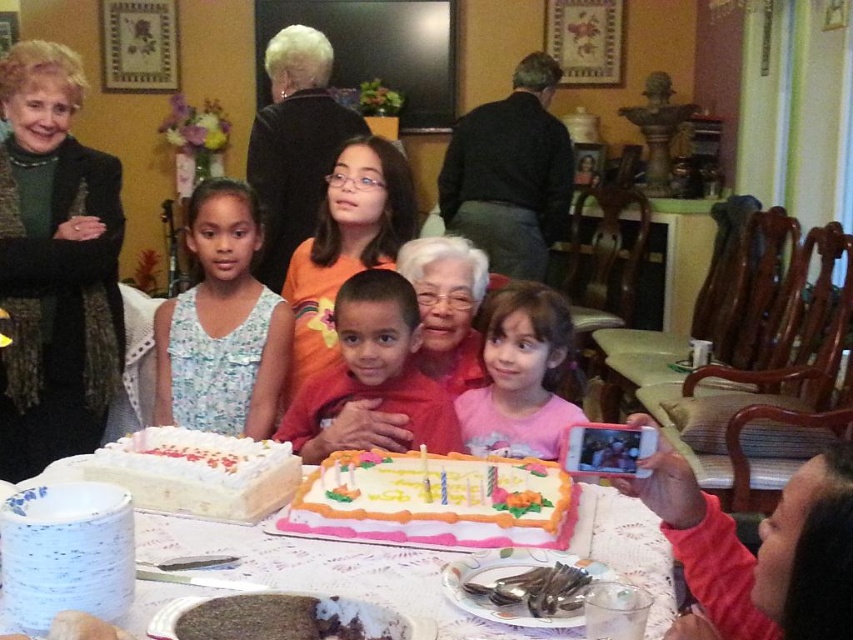
From the picture: Does pink fabric phone at lower right have a greater height compared to black fabric at upper center?

No, pink fabric phone at lower right is not taller than black fabric at upper center.

Which is above, pink fabric phone at lower right or black fabric at upper center?

Positioned higher is black fabric at upper center.

Where is `pink fabric phone at lower right`? The image size is (853, 640). pink fabric phone at lower right is located at coordinates (759, 550).

Is black fabric at upper center to the right of white frosted cake at lower left from the viewer's perspective?

In fact, black fabric at upper center is to the left of white frosted cake at lower left.

Does black fabric at upper center come behind white frosted cake at lower left?

Yes, black fabric at upper center is behind white frosted cake at lower left.

Find the location of a particular element. black fabric at upper center is located at coordinates (294, 145).

Does pink fabric phone at lower right come in front of pink cotton shirt at center?

Yes.

Can you confirm if pink fabric phone at lower right is shorter than pink cotton shirt at center?

Yes.

The width and height of the screenshot is (853, 640). What do you see at coordinates (759, 550) in the screenshot? I see `pink fabric phone at lower right` at bounding box center [759, 550].

Identify the location of pink fabric phone at lower right. This screenshot has width=853, height=640. coord(759,550).